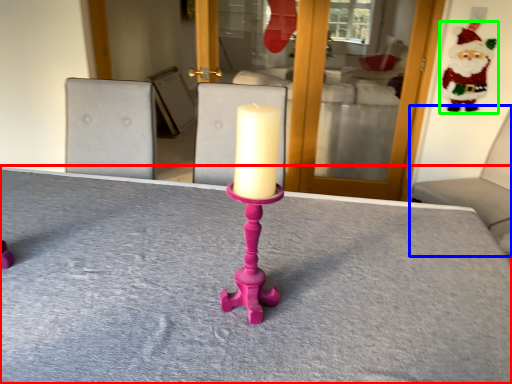
Question: Which object is positioned farthest from table (highlighted by a red box)? Select from furniture (highlighted by a blue box) and santa claus (highlighted by a green box).

Choices:
 (A) furniture
 (B) santa claus

Answer: (B)